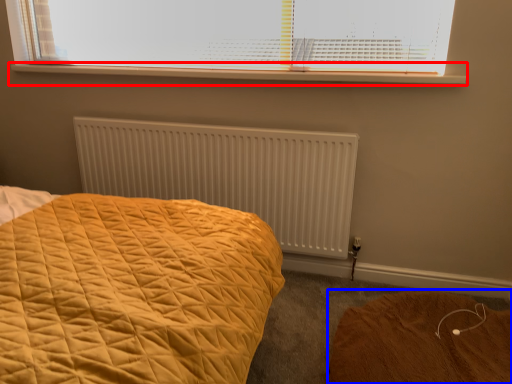
Question: Which object appears closest to the camera in this image, window sill (highlighted by a red box) or plain (highlighted by a blue box)?

Choices:
 (A) window sill
 (B) plain

Answer: (B)